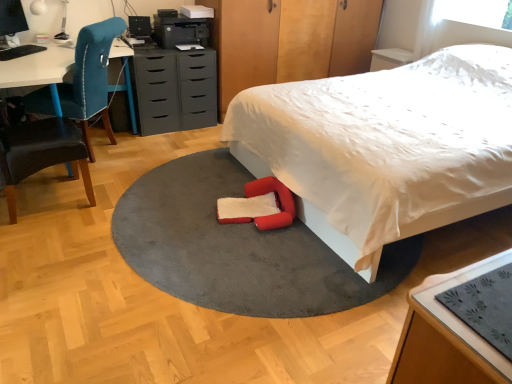
Image resolution: width=512 pixels, height=384 pixels. Find the location of `vacant region below velvet teal chair at left, the second chair when ordered from back to front (from a real-world perspective)`. vacant region below velvet teal chair at left, the second chair when ordered from back to front (from a real-world perspective) is located at coordinates (49, 200).